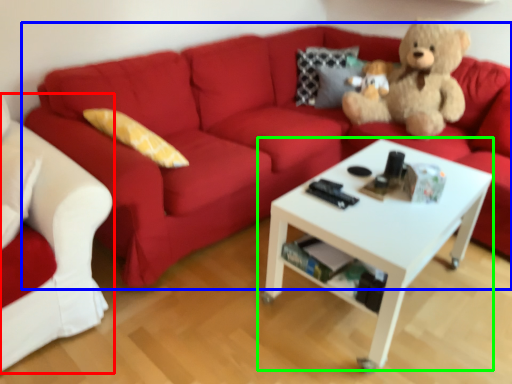
Question: Considering the real-world distances, which object is closest to studio couch (highlighted by a red box)? studio couch (highlighted by a blue box) or coffee table (highlighted by a green box).

Choices:
 (A) studio couch
 (B) coffee table

Answer: (A)